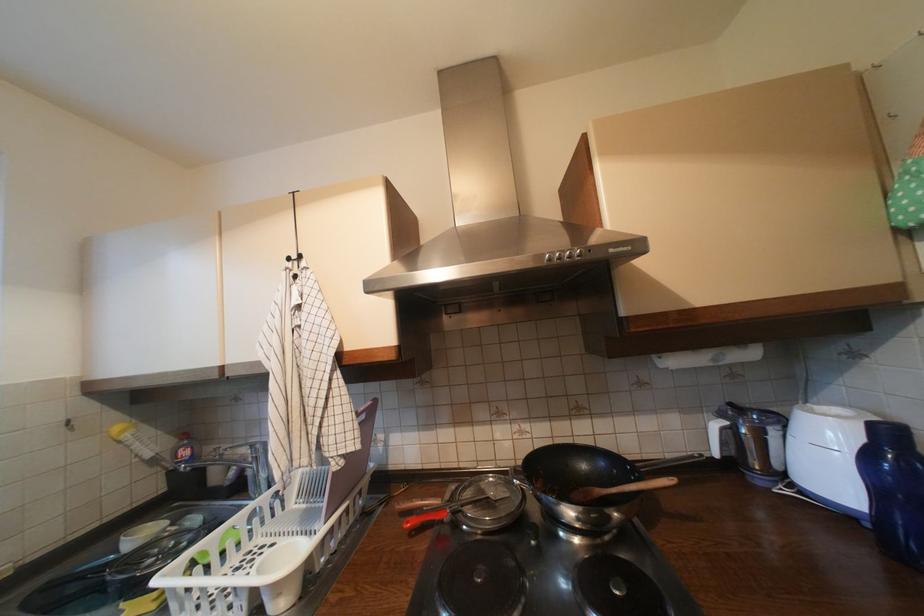
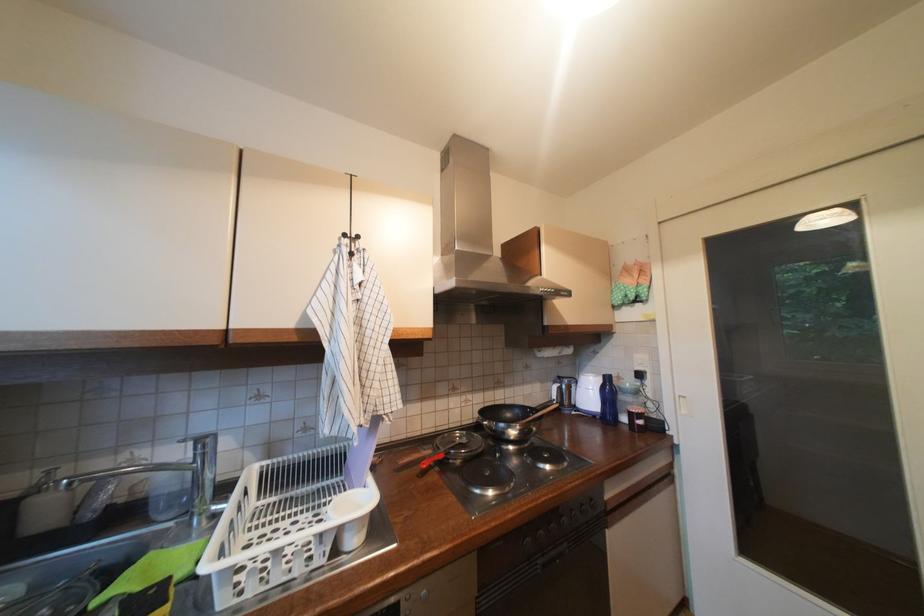
Question: The camera is either moving clockwise (left) or counter-clockwise (right) around the object. The first image is from the beginning of the video and the second image is from the end. Is the camera moving left or right when shooting the video?

Choices:
 (A) Left
 (B) Right

Answer: (A)